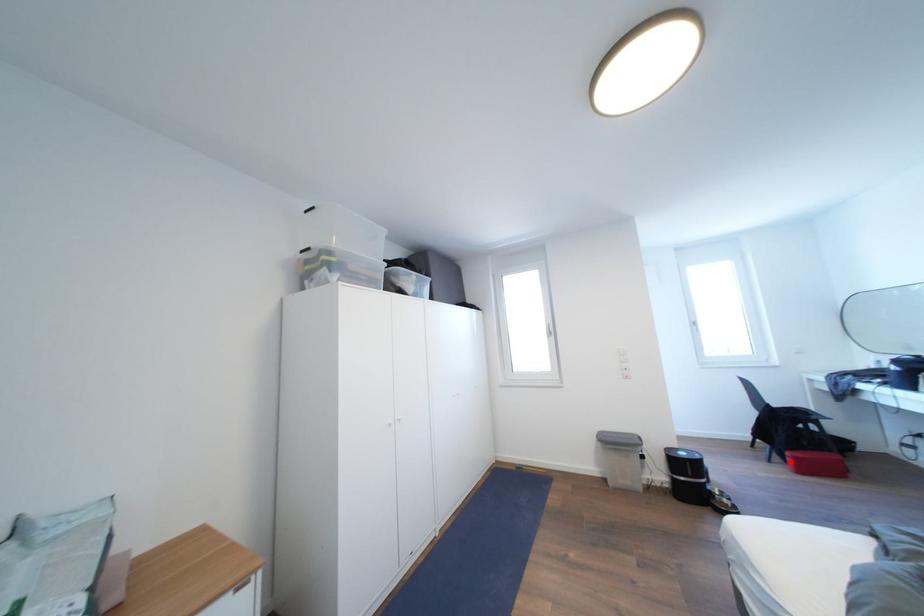
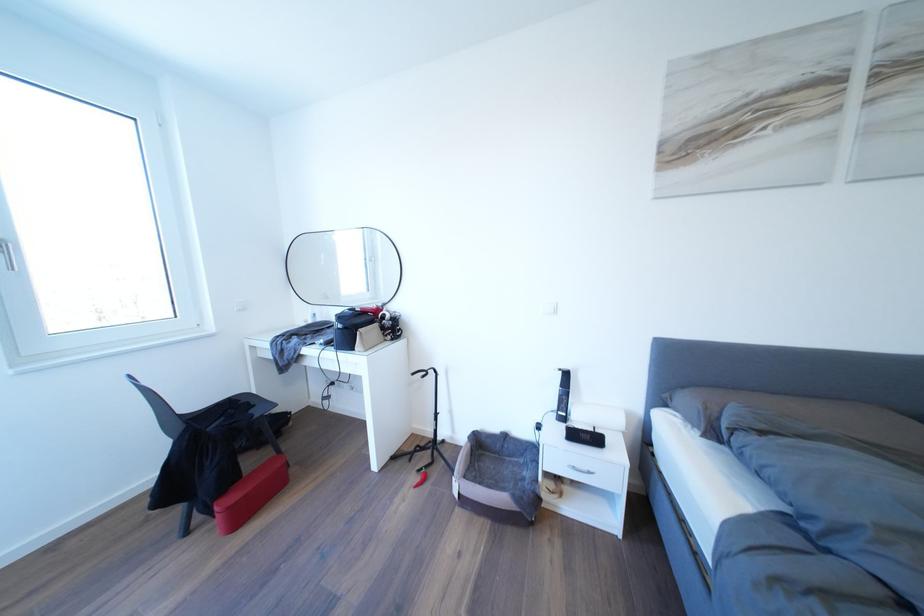
Question: I am providing you with two images of the same scene from different viewpoints. In image1, a red point is highlighted. Considering the same 3D point in image2, which of the following is correct?

Choices:
 (A) It is closer
 (B) It is farther

Answer: (A)